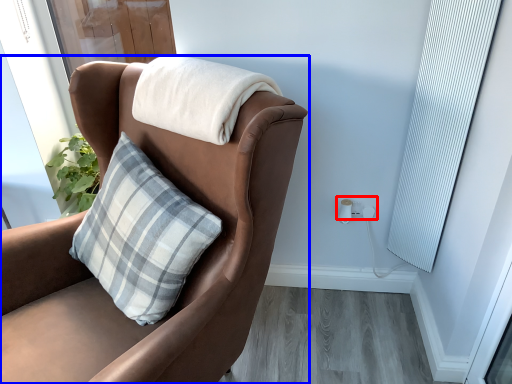
Question: Which object is further to the camera taking this photo, electric outlet (highlighted by a red box) or chair (highlighted by a blue box)?

Choices:
 (A) electric outlet
 (B) chair

Answer: (A)